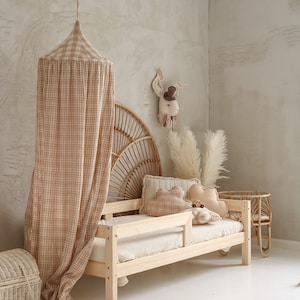
Where is `beige walls`? The width and height of the screenshot is (300, 300). beige walls is located at coordinates (150, 56), (247, 51).